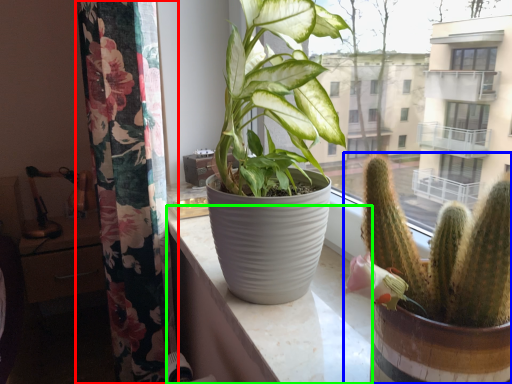
Question: Estimate the real-world distances between objects in this image. Which object is farther from curtain (highlighted by a red box), houseplant (highlighted by a blue box) or counter top (highlighted by a green box)?

Choices:
 (A) houseplant
 (B) counter top

Answer: (A)